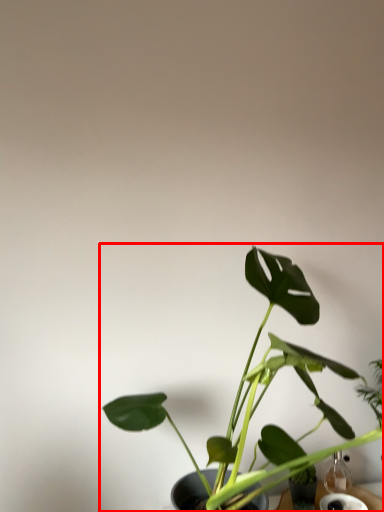
Question: From the image's perspective, what is the correct spatial positioning of houseplant (annotated by the red box) in reference to glass vase?

Choices:
 (A) above
 (B) below

Answer: (A)